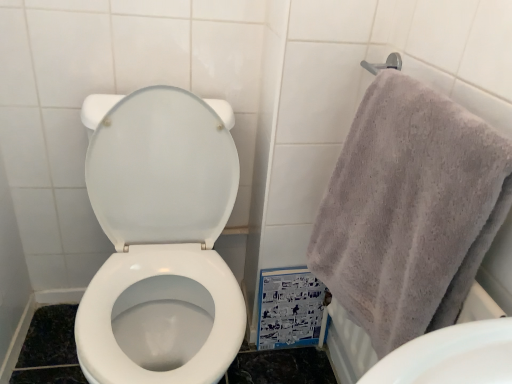
This screenshot has width=512, height=384. Find the location of `white glossy toilet at center`. white glossy toilet at center is located at coordinates (161, 232).

The image size is (512, 384). Describe the element at coordinates (161, 232) in the screenshot. I see `white glossy toilet at center` at that location.

Measure the distance between point (174, 180) and camera.

The distance of point (174, 180) from camera is 3.51 feet.

What is the approximate height of gray cotton towel at upper right?

It is 21.57 inches.

This screenshot has width=512, height=384. What do you see at coordinates (410, 210) in the screenshot?
I see `gray cotton towel at upper right` at bounding box center [410, 210].

Where is `gray cotton towel at upper right`? gray cotton towel at upper right is located at coordinates (410, 210).

The height and width of the screenshot is (384, 512). What are the coordinates of `white glossy toilet at center` in the screenshot? It's located at (161, 232).

Which is more to the left, gray cotton towel at upper right or white glossy toilet at center?

white glossy toilet at center.

Which object is further away from the camera taking this photo, gray cotton towel at upper right or white glossy toilet at center?

white glossy toilet at center.

Between point (440, 281) and point (220, 143), which one is positioned in front?

Point (440, 281)

From the image's perspective, which one is positioned lower, gray cotton towel at upper right or white glossy toilet at center?

white glossy toilet at center appears lower in the image.

From a real-world perspective, which object rests below the other?

From a 3D spatial view, white glossy toilet at center is below.

Is gray cotton towel at upper right wider than white glossy toilet at center?

In fact, gray cotton towel at upper right might be narrower than white glossy toilet at center.

Between gray cotton towel at upper right and white glossy toilet at center, which one has more height?

white glossy toilet at center.

Considering the sizes of objects gray cotton towel at upper right and white glossy toilet at center in the image provided, who is smaller, gray cotton towel at upper right or white glossy toilet at center?

With smaller size is gray cotton towel at upper right.

Is gray cotton towel at upper right located outside white glossy toilet at center?

Yes, gray cotton towel at upper right is not within white glossy toilet at center.

Is gray cotton towel at upper right with white glossy toilet at center?

No, gray cotton towel at upper right is not next to white glossy toilet at center.

Is gray cotton towel at upper right looking in the opposite direction of white glossy toilet at center?

No, gray cotton towel at upper right is not facing away from white glossy toilet at center.

Identify the location of towel above the white glossy toilet at center (from the image's perspective). This screenshot has height=384, width=512. (410, 210).

Which object is positioned more to the left, white glossy toilet at center or gray cotton towel at upper right?

Positioned to the left is white glossy toilet at center.

Does white glossy toilet at center come behind gray cotton towel at upper right?

That is True.

Does point (200, 253) come closer to viewer compared to point (452, 184)?

That is False.

From the image's perspective, is white glossy toilet at center on gray cotton towel at upper right?

No.

From a real-world perspective, which is physically above, white glossy toilet at center or gray cotton towel at upper right?

In real-world perspective, gray cotton towel at upper right is above.

Is white glossy toilet at center thinner than gray cotton towel at upper right?

Incorrect, the width of white glossy toilet at center is not less than that of gray cotton towel at upper right.

Is white glossy toilet at center taller or shorter than gray cotton towel at upper right?

white glossy toilet at center is taller than gray cotton towel at upper right.

Is white glossy toilet at center smaller than gray cotton towel at upper right?

Incorrect, white glossy toilet at center is not smaller in size than gray cotton towel at upper right.

Is white glossy toilet at center situated inside gray cotton towel at upper right or outside?

white glossy toilet at center cannot be found inside gray cotton towel at upper right.

Are white glossy toilet at center and gray cotton towel at upper right making contact?

No, white glossy toilet at center is not beside gray cotton towel at upper right.

Is white glossy toilet at center facing away from gray cotton towel at upper right?

No, gray cotton towel at upper right is not at the back of white glossy toilet at center.

This screenshot has height=384, width=512. What are the coordinates of `toilet behind the gray cotton towel at upper right` in the screenshot? It's located at (161, 232).

This screenshot has height=384, width=512. In the image, there is a white glossy toilet at center. What are the coordinates of `towel above it (from the image's perspective)` in the screenshot? It's located at (410, 210).

At what (x,y) coordinates should I click in order to perform the action: click on towel that is above the white glossy toilet at center (from a real-world perspective). Please return your answer as a coordinate pair (x, y). Looking at the image, I should click on (410, 210).